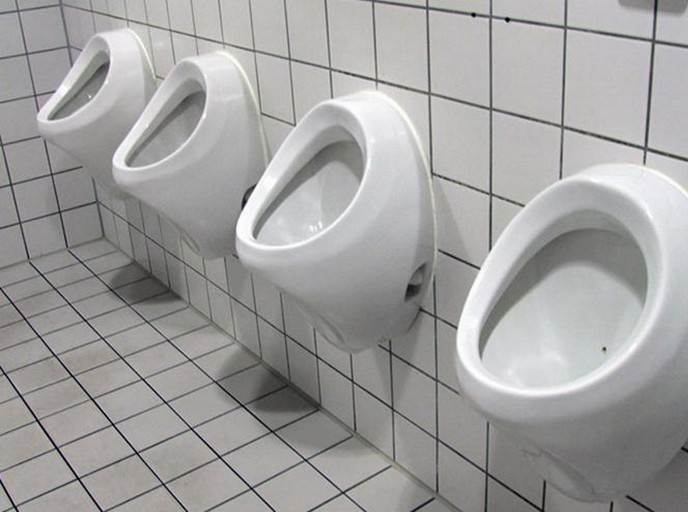
You are a GUI agent. You are given a task and a screenshot of the screen. Output one action in this format:
    pyautogui.click(x=<x>, y=<y>)
    Task: Click on the male restroom
    This screenshot has height=512, width=688.
    Given the screenshot: What is the action you would take?
    pyautogui.click(x=96, y=108), pyautogui.click(x=190, y=169), pyautogui.click(x=298, y=255), pyautogui.click(x=484, y=371)